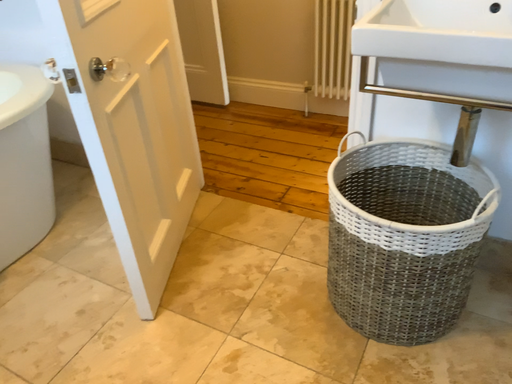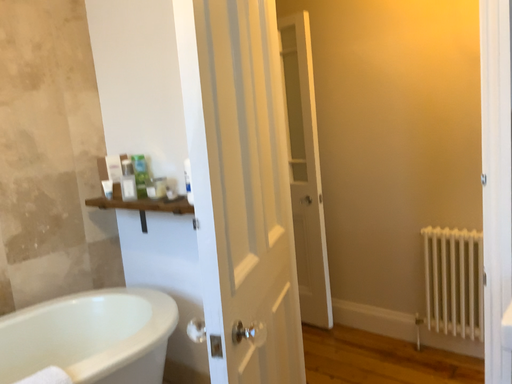
Question: Which way did the camera rotate in the video?

Choices:
 (A) rotated upward
 (B) rotated downward

Answer: (A)